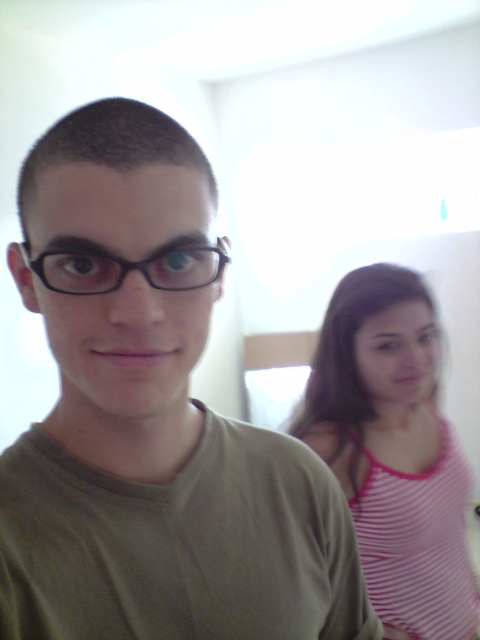
Question: Which of the following is the farthest from the observer?

Choices:
 (A) pink striped tank top at right
 (B) matte green shirt at center
 (C) black plastic glasses at center

Answer: (A)

Question: Does pink striped tank top at right come in front of black plastic glasses at center?

Choices:
 (A) no
 (B) yes

Answer: (A)

Question: Which point is farther to the camera?

Choices:
 (A) matte green shirt at center
 (B) black plastic glasses at center

Answer: (B)

Question: Does matte green shirt at center have a greater width compared to pink striped tank top at right?

Choices:
 (A) no
 (B) yes

Answer: (A)

Question: Is pink striped tank top at right thinner than black plastic glasses at center?

Choices:
 (A) no
 (B) yes

Answer: (A)

Question: Estimate the real-world distances between objects in this image. Which object is farther from the matte green shirt at center?

Choices:
 (A) pink striped tank top at right
 (B) black plastic glasses at center

Answer: (A)